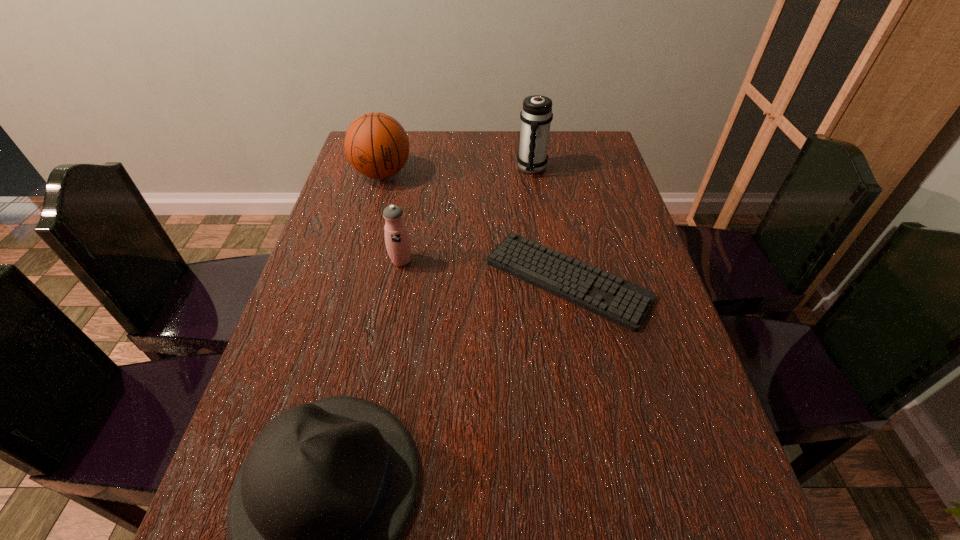
What are the coordinates of `unoccupied position between the basketball and the taller thermos bottle` in the screenshot? It's located at (457, 171).

This screenshot has width=960, height=540. In order to click on free space between the right thermos bottle and the basketball in this screenshot , I will do `click(457, 171)`.

Find the location of `empty location between the shortest object and the basketball`. empty location between the shortest object and the basketball is located at coordinates (475, 227).

You are a GUI agent. You are given a task and a screenshot of the screen. Output one action in this format:
    pyautogui.click(x=<x>, y=<y>)
    Task: Click on the vacant area that lies between the left thermos bottle and the computer keyboard
    
    Given the screenshot: What is the action you would take?
    pyautogui.click(x=484, y=271)

Locate an element on the screen. The width and height of the screenshot is (960, 540). free area in between the computer keyboard and the taller thermos bottle is located at coordinates (549, 224).

This screenshot has width=960, height=540. What are the coordinates of `free space between the computer keyboard and the basketball` in the screenshot? It's located at (475, 227).

Locate an element on the screen. The width and height of the screenshot is (960, 540). vacant space in between the shorter thermos bottle and the shortest object is located at coordinates (484, 271).

The width and height of the screenshot is (960, 540). What are the coordinates of `object that ranks as the closest to the taller thermos bottle` in the screenshot? It's located at (622, 302).

Find the location of a particular element. This screenshot has width=960, height=540. object that is the fourth nearest to the taller thermos bottle is located at coordinates (314, 514).

Where is `free space in the image that satisfies the following two spatial constraints: 1. on the side with the handle of the taller thermos bottle; 2. on the right side of the computer keyboard`? This screenshot has width=960, height=540. free space in the image that satisfies the following two spatial constraints: 1. on the side with the handle of the taller thermos bottle; 2. on the right side of the computer keyboard is located at coordinates (548, 280).